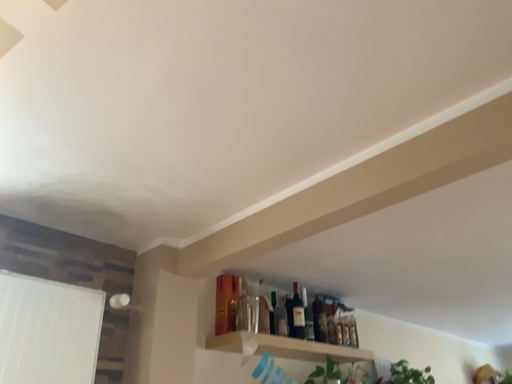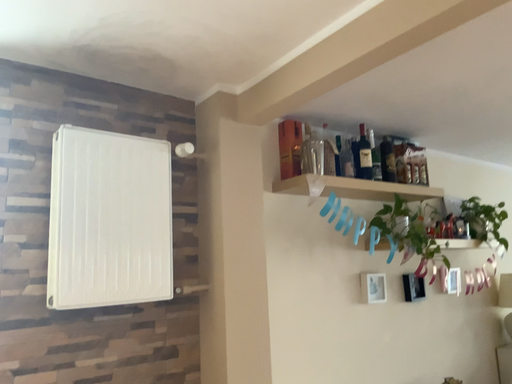
Question: How did the camera likely rotate when shooting the video?

Choices:
 (A) rotated downward
 (B) rotated upward

Answer: (A)